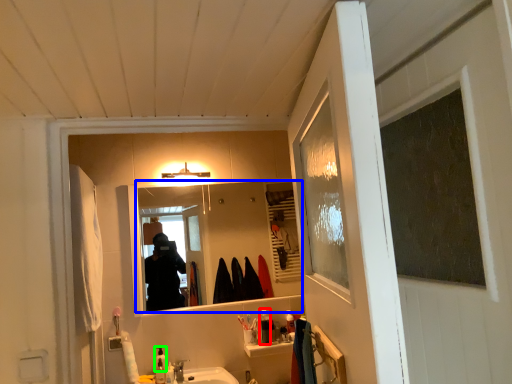
Question: Which is nearer to the toiletry (highlighted by a red box)? mirror (highlighted by a blue box) or toiletry (highlighted by a green box).

Choices:
 (A) mirror
 (B) toiletry

Answer: (B)